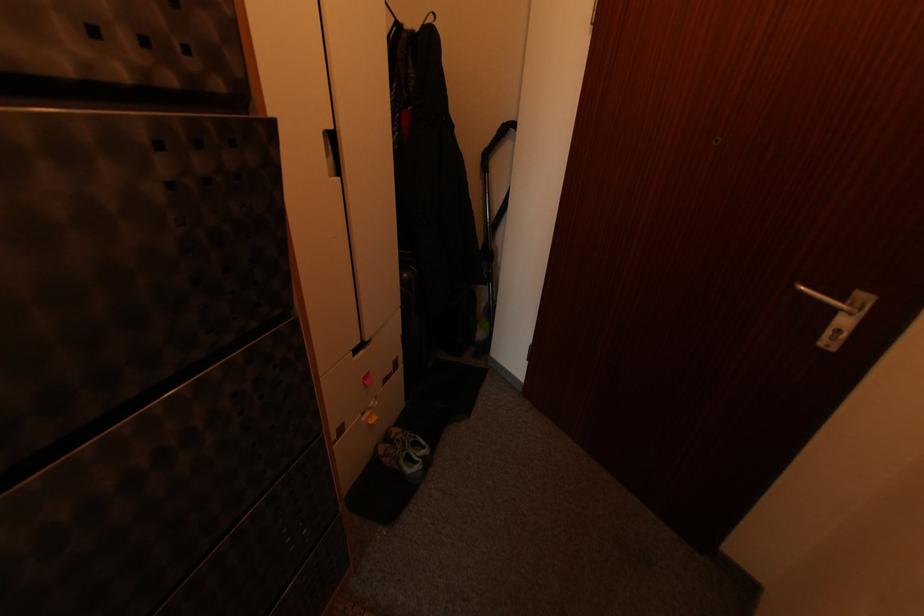
Image resolution: width=924 pixels, height=616 pixels. What do you see at coordinates (829, 300) in the screenshot?
I see `the silver door handle` at bounding box center [829, 300].